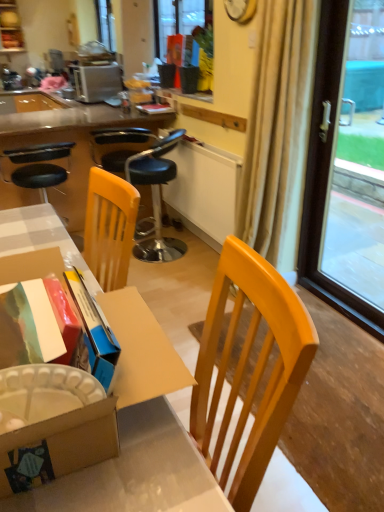
Question: From the image's perspective, is beige fabric curtain at right below matte black desk at center, which ranks as the 1th desk in top-to-bottom order?

Choices:
 (A) yes
 (B) no

Answer: (A)

Question: From the image's perspective, is beige fabric curtain at right above matte black desk at center, marked as the 1th desk in a back-to-front arrangement?

Choices:
 (A) no
 (B) yes

Answer: (A)

Question: Is beige fabric curtain at right far away from matte black desk at center, which appears as the second desk when viewed from the front?

Choices:
 (A) no
 (B) yes

Answer: (B)

Question: Considering the relative sizes of beige fabric curtain at right and matte black desk at center, marked as the 1th desk in a back-to-front arrangement, in the image provided, is beige fabric curtain at right taller than matte black desk at center, marked as the 1th desk in a back-to-front arrangement,?

Choices:
 (A) yes
 (B) no

Answer: (A)

Question: Can you confirm if beige fabric curtain at right is positioned to the right of matte black desk at center, which appears as the second desk when viewed from the front?

Choices:
 (A) yes
 (B) no

Answer: (A)

Question: Is beige fabric curtain at right bigger than matte black desk at center, which appears as the second desk when viewed from the front?

Choices:
 (A) yes
 (B) no

Answer: (B)

Question: From a real-world perspective, is transparent glass window at right on top of matte black desk at center, which appears as the second desk when viewed from the front?

Choices:
 (A) no
 (B) yes

Answer: (B)

Question: Is transparent glass window at right oriented away from matte black desk at center, which appears as the second desk when viewed from the front?

Choices:
 (A) no
 (B) yes

Answer: (A)

Question: From the image's perspective, would you say transparent glass window at right is shown under matte black desk at center, marked as the 1th desk in a back-to-front arrangement?

Choices:
 (A) no
 (B) yes

Answer: (B)

Question: Does transparent glass window at right appear on the left side of matte black desk at center, marked as the 1th desk in a back-to-front arrangement?

Choices:
 (A) yes
 (B) no

Answer: (B)

Question: From the image's perspective, would you say transparent glass window at right is positioned over matte black desk at center, the 2th desk from the bottom?

Choices:
 (A) no
 (B) yes

Answer: (A)

Question: Is transparent glass window at right positioned far away from matte black desk at center, which appears as the second desk when viewed from the front?

Choices:
 (A) no
 (B) yes

Answer: (B)

Question: Would you say matte black flowerpot at upper center is a long distance from black leather stool at center, which is the 2th chair from left to right?

Choices:
 (A) yes
 (B) no

Answer: (B)